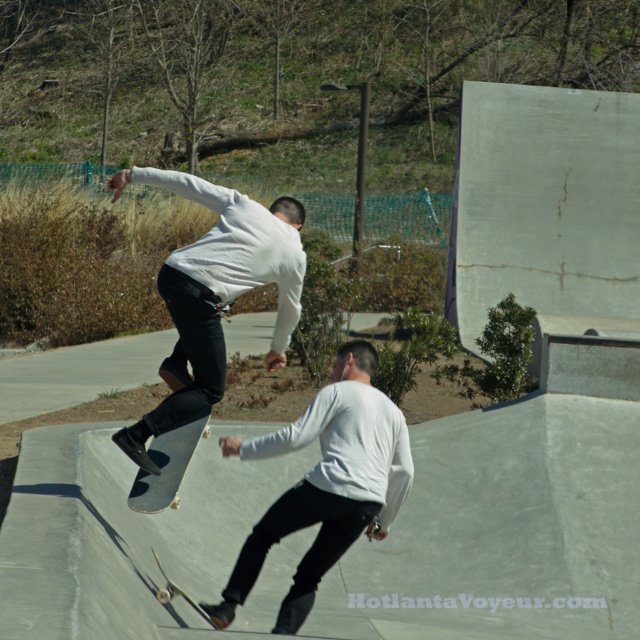
Is matte white shirt at center bigger than wooden skateboard at lower center?

No, matte white shirt at center is not bigger than wooden skateboard at lower center.

How much distance is there between matte white shirt at center and wooden skateboard at lower center?

They are 36.51 inches apart.

The height and width of the screenshot is (640, 640). Find the location of `matte white shirt at center`. matte white shirt at center is located at coordinates (214, 292).

Locate an element on the screen. The image size is (640, 640). matte white shirt at center is located at coordinates [214, 292].

Is white matte shirt at center taller than wooden skateboard at center?

Indeed, white matte shirt at center has a greater height compared to wooden skateboard at center.

Who is more forward, (400,438) or (131,502)?

Point (400,438) is more forward.

Identify the location of white matte shirt at center. The image size is (640, 640). (326, 483).

Can you confirm if white matte shirt at center is positioned to the right of wooden skateboard at lower center?

Indeed, white matte shirt at center is positioned on the right side of wooden skateboard at lower center.

Who is positioned more to the right, white matte shirt at center or wooden skateboard at lower center?

white matte shirt at center

Which is behind, point (307, 477) or point (220, 628)?

Point (220, 628)

Locate an element on the screen. This screenshot has width=640, height=640. white matte shirt at center is located at coordinates (326, 483).